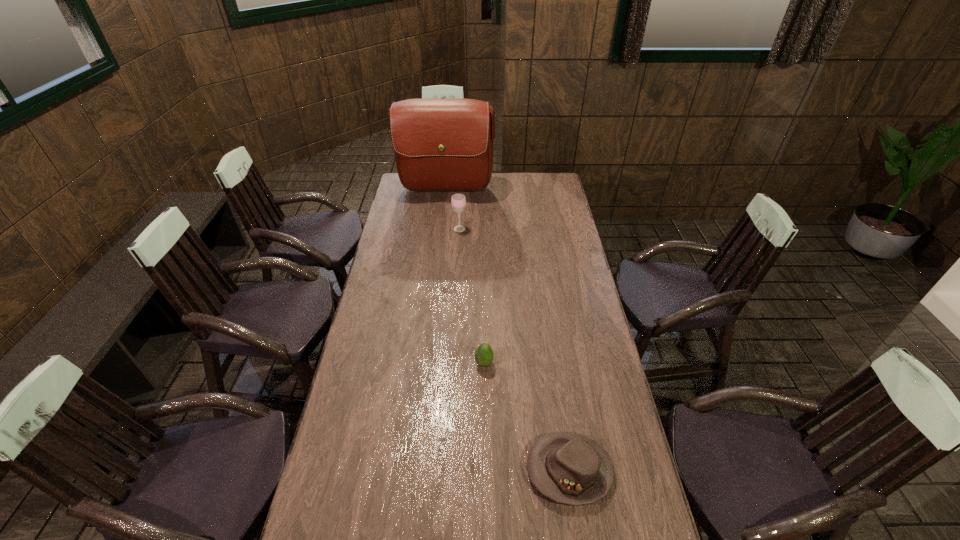
Locate an element on the screen. The width and height of the screenshot is (960, 540). free space between the avocado and the wineglass is located at coordinates (471, 296).

Find the location of `empty location between the wineglass and the rightmost object`. empty location between the wineglass and the rightmost object is located at coordinates (515, 349).

This screenshot has height=540, width=960. I want to click on unoccupied area between the avocado and the hat, so click(x=526, y=417).

The image size is (960, 540). In order to click on free point between the farthest object and the nearest object in this screenshot , I will do `click(508, 330)`.

Identify the location of vacant space that is in between the second nearest object and the second tallest object. (471, 296).

You are a GUI agent. You are given a task and a screenshot of the screen. Output one action in this format:
    pyautogui.click(x=<x>, y=<y>)
    Task: Click on the vacant space in between the rightmost object and the third nearest object
    The image size is (960, 540).
    Given the screenshot: What is the action you would take?
    pyautogui.click(x=515, y=349)

The height and width of the screenshot is (540, 960). Identify the location of vacant space that is in between the nearest object and the avocado. (526, 417).

Identify the location of vacant space that's between the avocado and the satchel. Image resolution: width=960 pixels, height=540 pixels. click(x=465, y=277).

At what (x,y) coordinates should I click in order to perform the action: click on free space between the second nearest object and the farthest object. Please return your answer as a coordinate pair (x, y). Image resolution: width=960 pixels, height=540 pixels. Looking at the image, I should click on (465, 277).

Where is `blank region between the satchel and the rightmost object`? blank region between the satchel and the rightmost object is located at coordinates (508, 330).